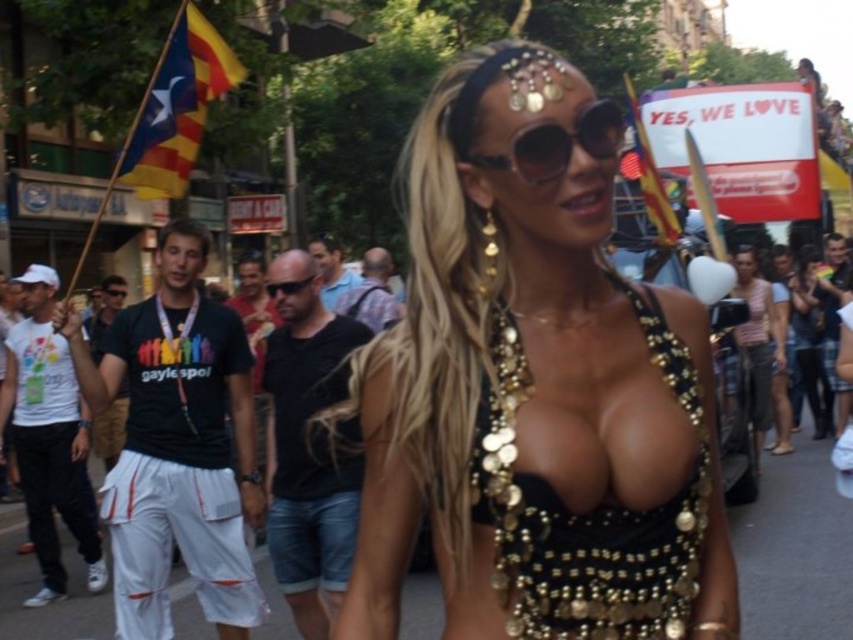
Consider the image. Can you confirm if yellow and red checkered fabric at upper left is taller than sunglasses at center?

Correct, yellow and red checkered fabric at upper left is much taller as sunglasses at center.

Is yellow and red checkered fabric at upper left above sunglasses at center?

Correct, yellow and red checkered fabric at upper left is located above sunglasses at center.

Describe the element at coordinates (177, 106) in the screenshot. I see `yellow and red checkered fabric at upper left` at that location.

Locate an element on the screen. This screenshot has height=640, width=853. yellow and red checkered fabric at upper left is located at coordinates (177, 106).

Does point (831, 404) come farther from viewer compared to point (289, 292)?

Yes.

Is gold sequined top at center above black plastic sunglasses at center?

Actually, gold sequined top at center is below black plastic sunglasses at center.

Who is more distant from viewer, (804, 332) or (306, 282)?

The point (804, 332) is behind.

In order to click on gold sequined top at center in this screenshot , I will do `click(809, 340)`.

Can you confirm if yellow and red checkered fabric at upper left is positioned below gold sequined top at center?

Actually, yellow and red checkered fabric at upper left is above gold sequined top at center.

Can you confirm if yellow and red checkered fabric at upper left is thinner than gold sequined top at center?

Indeed, yellow and red checkered fabric at upper left has a lesser width compared to gold sequined top at center.

You are a GUI agent. You are given a task and a screenshot of the screen. Output one action in this format:
    pyautogui.click(x=<x>, y=<y>)
    Task: Click on the yellow and red checkered fabric at upper left
    The width and height of the screenshot is (853, 640).
    Given the screenshot: What is the action you would take?
    pyautogui.click(x=177, y=106)